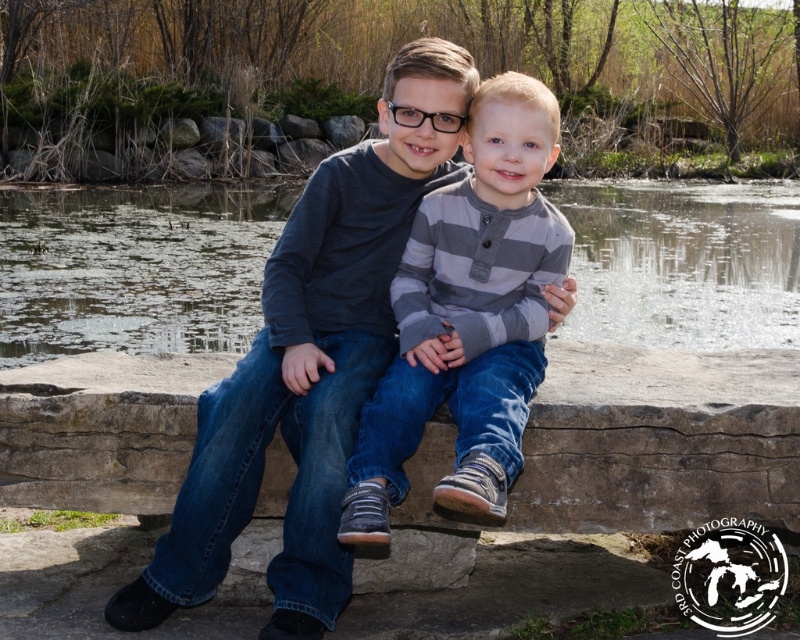
You are a photographer standing at the edge of the pond. You want to capture a photo of the clear water at center and the matte blue jeans at center in the same frame. Given that your camera has a maximum focus range of 20 meters, will you be able to include both objects in focus?

The clear water at center and matte blue jeans at center are 22.64 meters apart from each other. Since the distance exceeds the camera maximum focus range of 20 meters, the photographer cannot include both objects in focus.

You are a photographer wanting to capture a photo of the two boys on the stone bench by the water. You need to ensure that both the clear water at center and the gray striped shirt at center are fully visible in the frame. Based on their positions, is there a chance that one might block the view of the other?

The clear water at center might be wider than gray striped shirt at center, so there is a possibility that the clear water at center could block the view of the gray striped shirt at center if positioned in front.

You are standing at the edge of the pond and want to throw a stone into the clear water at center. If you can throw a stone 25 feet, will it land in the water?

The clear water at center is 24.94 feet away from the viewer. Since the viewer can throw a stone 25 feet, the stone will land in the water.